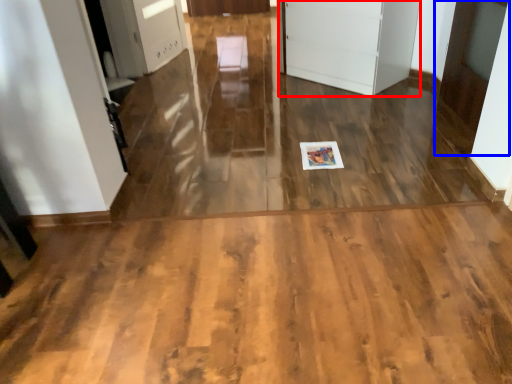
Question: Which object appears closest to the camera in this image, door (highlighted by a red box) or door (highlighted by a blue box)?

Choices:
 (A) door
 (B) door

Answer: (B)